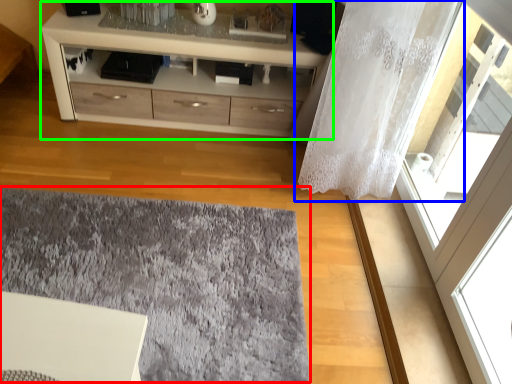
Question: Which object is positioned closest to mat (highlighted by a red box)? Select from curtain (highlighted by a blue box) and chest of drawers (highlighted by a green box).

Choices:
 (A) curtain
 (B) chest of drawers

Answer: (A)